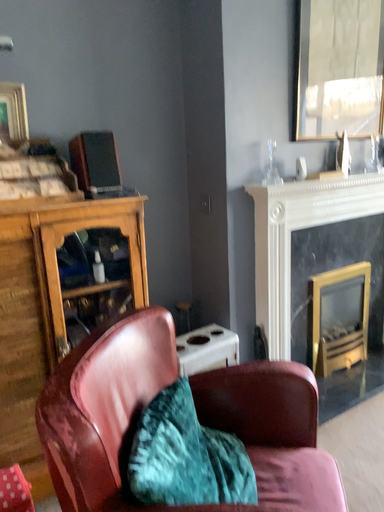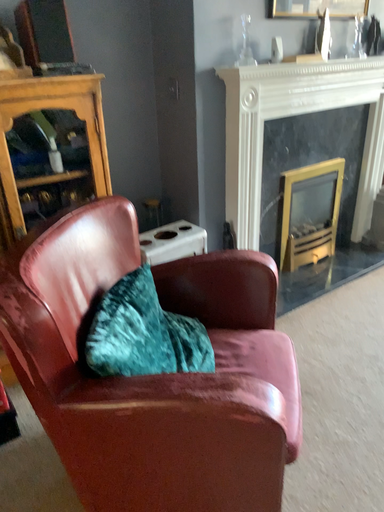
Question: Which way did the camera rotate in the video?

Choices:
 (A) rotated upward
 (B) rotated downward

Answer: (B)